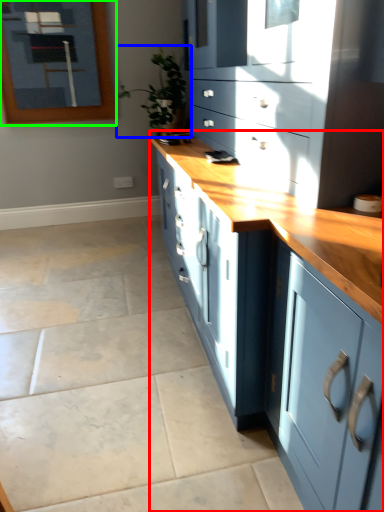
Question: Estimate the real-world distances between objects in this image. Which object is closer to cabinetry (highlighted by a red box), houseplant (highlighted by a blue box) or picture frame (highlighted by a green box)?

Choices:
 (A) houseplant
 (B) picture frame

Answer: (A)